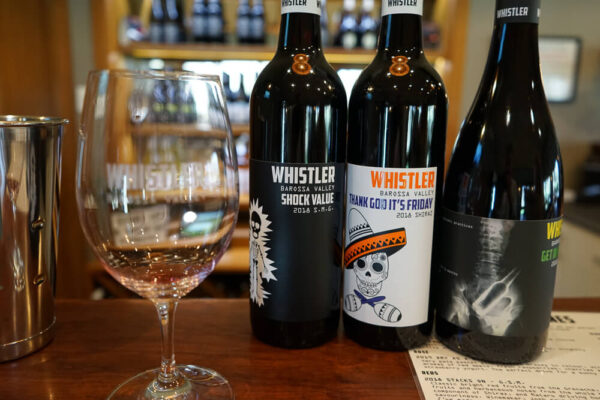
Image resolution: width=600 pixels, height=400 pixels. Find the location of `shelves`. shelves is located at coordinates (241, 47).